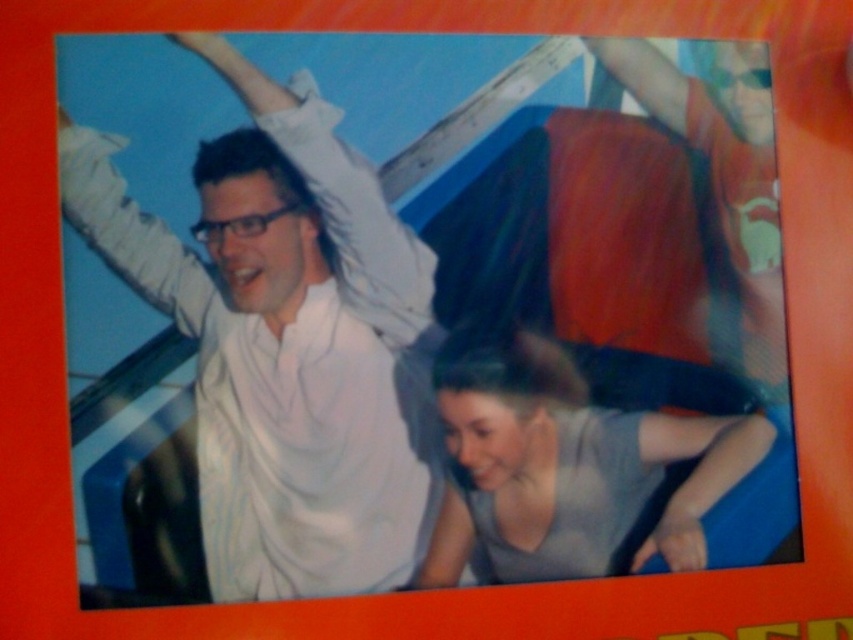
You are a photographer trying to capture a clear shot of both the white cotton shirt at upper left and the gray matte shirt at lower center. Based on their positions, which shirt should you focus on first to ensure both are in focus?

The white cotton shirt at upper left is in front of the gray matte shirt at lower center, so you should focus on the gray matte shirt at lower center first. This way, since it is behind, adjusting focus from there might help both be in focus.

You are standing in front of the amusement park photo with the orange border. You notice two points marked in the image. The first point is at coordinates point (335, 556) and the second is at point (546, 496). Which of these two points is nearer to you?

Point (335, 556) is closer to the viewer than point (546, 496).

You are a photographer reviewing this image. You notice the white cotton shirt at upper left and the smooth skin arm at lower right. Which object is positioned higher in the image?

The white cotton shirt at upper left is positioned higher than the smooth skin arm at lower right.